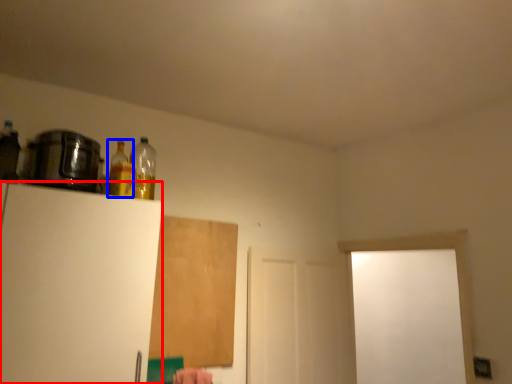
Question: Among these objects, which one is nearest to the camera, appliance (highlighted by a red box) or bottle (highlighted by a blue box)?

Choices:
 (A) appliance
 (B) bottle

Answer: (A)